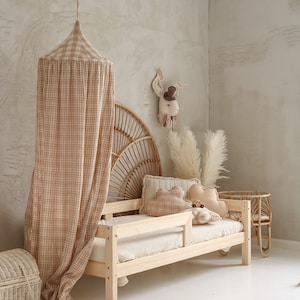
Find the location of a particular element. This screenshot has width=300, height=300. decor is located at coordinates (171, 98), (173, 145), (184, 156), (214, 156), (259, 201), (128, 147), (18, 277).